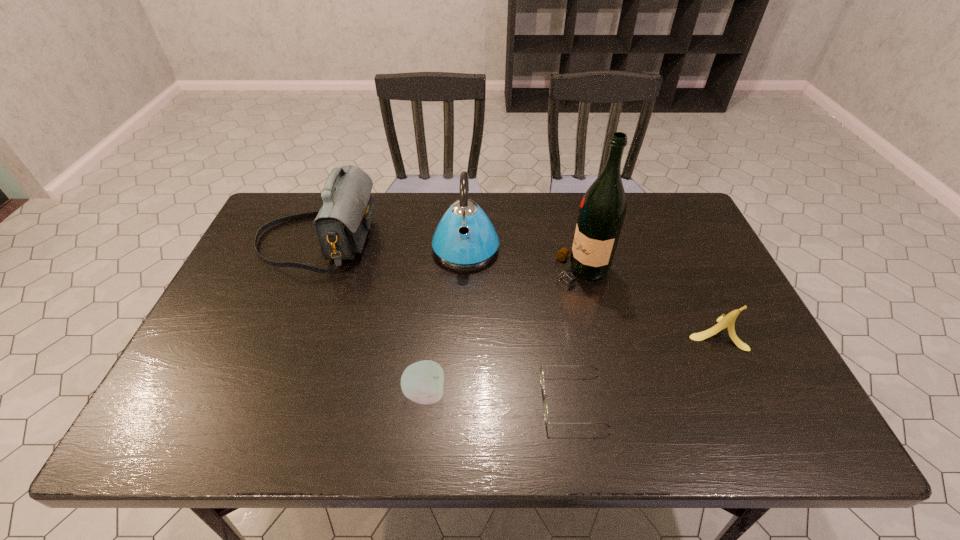
At what (x,y) coordinates should I click in order to perform the action: click on vacant point located between the leftmost object and the shortest object. Please return your answer as a coordinate pair (x, y). This screenshot has width=960, height=540. Looking at the image, I should click on (444, 320).

The height and width of the screenshot is (540, 960). What are the coordinates of `free spot between the shortest object and the banana` in the screenshot? It's located at (644, 366).

Identify the location of empty space that is in between the shortest object and the shoulder bag. (444, 320).

Image resolution: width=960 pixels, height=540 pixels. I want to click on vacant area between the shortest object and the fourth farthest object, so coord(644,366).

At what (x,y) coordinates should I click in order to perform the action: click on unoccupied position between the banana and the leftmost object. Please return your answer as a coordinate pair (x, y). Image resolution: width=960 pixels, height=540 pixels. Looking at the image, I should click on (516, 286).

Identify the location of vacant space that is in between the tallest object and the kettle. The width and height of the screenshot is (960, 540). (523, 259).

Where is `vacant area that lies between the fourth farthest object and the kettle`? The height and width of the screenshot is (540, 960). vacant area that lies between the fourth farthest object and the kettle is located at coordinates (590, 290).

This screenshot has height=540, width=960. Find the location of `free spot between the sunglasses and the apple`. free spot between the sunglasses and the apple is located at coordinates coord(499,397).

Where is `blank region between the third nearest object and the shoulder bag`? The width and height of the screenshot is (960, 540). blank region between the third nearest object and the shoulder bag is located at coordinates (516, 286).

Locate which object ranks fifth in proximity to the sunglasses. Please provide its 2D coordinates. Your answer should be formatted as a tuple, i.e. [(x, y)], where the tuple contains the x and y coordinates of a point satisfying the conditions above.

[(342, 223)]